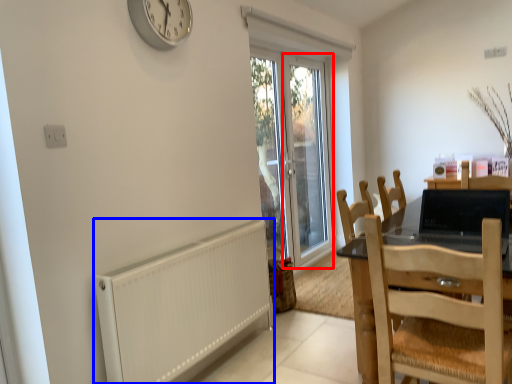
Question: Which point is further to the camera, screen door (highlighted by a red box) or radiator (highlighted by a blue box)?

Choices:
 (A) screen door
 (B) radiator

Answer: (A)